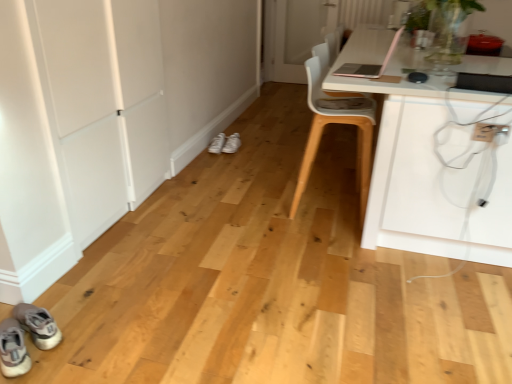
This screenshot has height=384, width=512. What do you see at coordinates (225, 144) in the screenshot? I see `white fabric sneakers at center, placed as the 3th footwear when sorted from bottom to top` at bounding box center [225, 144].

The image size is (512, 384). Describe the element at coordinates (13, 349) in the screenshot. I see `light gray fabric sneakers at lower left, which is counted as the first footwear, starting from the bottom` at that location.

This screenshot has width=512, height=384. In order to click on pink matte laptop at upper right in this screenshot , I will do `click(370, 64)`.

This screenshot has height=384, width=512. Identify the location of white plastic electric outlet at lower right. (488, 131).

This screenshot has width=512, height=384. What do you see at coordinates (488, 131) in the screenshot?
I see `white plastic electric outlet at lower right` at bounding box center [488, 131].

Measure the distance between point [209,147] and camera.

A distance of 3.63 meters exists between point [209,147] and camera.

Find the location of a particular element. The width and height of the screenshot is (512, 384). white plastic chair at upper right is located at coordinates (335, 123).

The width and height of the screenshot is (512, 384). Find the location of `white matte door at left, the first door from the bottom`. white matte door at left, the first door from the bottom is located at coordinates (105, 104).

This screenshot has width=512, height=384. What do you see at coordinates (294, 35) in the screenshot?
I see `white glass door at center, placed as the 2th door when sorted from front to back` at bounding box center [294, 35].

I want to click on white fabric sneakers at center, placed as the first footwear when sorted from top to bottom, so click(225, 144).

Does point (317, 7) lie in front of point (501, 125)?

That is False.

From a real-world perspective, which object stands above the other?

From a 3D spatial view, white plastic electric outlet at lower right is above.

Between white glass door at center, the first door when ordered from back to front, and white plastic electric outlet at lower right, which one is positioned behind?

white glass door at center, the first door when ordered from back to front, is more distant.

Is white matte door at left, the first door from the bottom, completely or partially outside of white leather sneakers at center, which ranks as the second footwear in left-to-right order?

That's correct, white matte door at left, the first door from the bottom, is outside of white leather sneakers at center, which ranks as the second footwear in left-to-right order.

Does white matte door at left, marked as the first door in a left-to-right arrangement, have a smaller size compared to white leather sneakers at center, which is counted as the 2th footwear, starting from the front?

No.

From the picture: Which is more to the right, white matte door at left, arranged as the 2th door when viewed from the top, or white leather sneakers at center, which is the 2th footwear from back to front?

From the viewer's perspective, white leather sneakers at center, which is the 2th footwear from back to front, appears more on the right side.

Does point (142, 68) come closer to viewer compared to point (214, 152)?

Yes, it is.

Based on their sizes in the image, would you say light gray fabric sneakers at lower left, positioned as the third footwear in right-to-left order, is bigger or smaller than pink matte laptop at upper right?

light gray fabric sneakers at lower left, positioned as the third footwear in right-to-left order, is smaller than pink matte laptop at upper right.

From the picture: From a real-world perspective, relative to pink matte laptop at upper right, is light gray fabric sneakers at lower left, marked as the 3th footwear in a back-to-front arrangement, vertically above or below?

Clearly, from a real-world perspective, light gray fabric sneakers at lower left, marked as the 3th footwear in a back-to-front arrangement, is below pink matte laptop at upper right.

Looking at this image, is light gray fabric sneakers at lower left, marked as the 3th footwear in a back-to-front arrangement, looking in the opposite direction of pink matte laptop at upper right?

light gray fabric sneakers at lower left, marked as the 3th footwear in a back-to-front arrangement, is not turned away from pink matte laptop at upper right.

Is light gray fabric sneakers at lower left, positioned as the third footwear in right-to-left order, in contact with pink matte laptop at upper right?

light gray fabric sneakers at lower left, positioned as the third footwear in right-to-left order, and pink matte laptop at upper right are not in contact.

Can you tell me how much white leather sneakers at center, which is the 2th footwear from back to front, and white glass door at center, which is the second door from bottom to top, differ in facing direction?

0.175 degrees separate the facing orientations of white leather sneakers at center, which is the 2th footwear from back to front, and white glass door at center, which is the second door from bottom to top.

Is white leather sneakers at center, which ranks as the second footwear in left-to-right order, in front of white glass door at center, which is the first door from right to left?

Yes, it is in front of white glass door at center, which is the first door from right to left.

Considering the relative sizes of white leather sneakers at center, which is counted as the 2th footwear, starting from the front, and white glass door at center, which is the 2th door in left-to-right order, in the image provided, is white leather sneakers at center, which is counted as the 2th footwear, starting from the front, shorter than white glass door at center, which is the 2th door in left-to-right order,?

Indeed, white leather sneakers at center, which is counted as the 2th footwear, starting from the front, has a lesser height compared to white glass door at center, which is the 2th door in left-to-right order.

Considering the relative sizes of white matte door at left, marked as the first door in a left-to-right arrangement, and pink matte laptop at upper right in the image provided, is white matte door at left, marked as the first door in a left-to-right arrangement, shorter than pink matte laptop at upper right?

No, white matte door at left, marked as the first door in a left-to-right arrangement, is not shorter than pink matte laptop at upper right.

From a real-world perspective, who is located higher, white matte door at left, arranged as the 2th door when viewed from the top, or pink matte laptop at upper right?

In real-world perspective, pink matte laptop at upper right is above.

Find the location of `laptop above the white matte door at left, the second door from the back (from the image's perspective)`. laptop above the white matte door at left, the second door from the back (from the image's perspective) is located at coordinates (370, 64).

Can you confirm if white matte door at left, the 1th door in the front-to-back sequence, is smaller than pink matte laptop at upper right?

No.

Which is farther from the camera, (226, 141) or (283, 51)?

The point (283, 51) is behind.

Can white glass door at center, placed as the 2th door when sorted from front to back, be found inside white fabric sneakers at center, placed as the 3th footwear when sorted from bottom to top?

That's incorrect, white glass door at center, placed as the 2th door when sorted from front to back, is not inside white fabric sneakers at center, placed as the 3th footwear when sorted from bottom to top.

Visually, is white fabric sneakers at center, placed as the first footwear when sorted from top to bottom, positioned to the left or to the right of white glass door at center, which is the second door from bottom to top?

Based on their positions, white fabric sneakers at center, placed as the first footwear when sorted from top to bottom, is located to the left of white glass door at center, which is the second door from bottom to top.

Locate an element on the screen. This screenshot has width=512, height=384. the 2nd door above the white fabric sneakers at center, which appears as the 3th footwear when viewed from the left (from the image's perspective) is located at coordinates [x=294, y=35].

Does pink matte laptop at upper right have a larger size compared to white plastic electric outlet at lower right?

Yes.

Is pink matte laptop at upper right thinner than white plastic electric outlet at lower right?

Incorrect, the width of pink matte laptop at upper right is not less than that of white plastic electric outlet at lower right.

Is point (394, 46) less distant than point (484, 136)?

No, (394, 46) is behind (484, 136).

Is pink matte laptop at upper right oriented away from white plastic electric outlet at lower right?

No, pink matte laptop at upper right is not facing the opposite direction of white plastic electric outlet at lower right.

Locate an element on the screen. electric outlet in front of the white glass door at center, placed as the 2th door when sorted from front to back is located at coordinates (488, 131).

The width and height of the screenshot is (512, 384). Identify the location of the 1st footwear behind the white matte door at left, marked as the first door in a left-to-right arrangement, starting your count from the anchor. (217, 144).

When comparing their distances from white fabric sneakers at center, the 1th footwear viewed from the right, does white leather sneakers at center, which ranks as the 2th footwear in right-to-left order, or white glass door at center, which is the second door from bottom to top, seem further?

white glass door at center, which is the second door from bottom to top, is positioned further to the anchor white fabric sneakers at center, the 1th footwear viewed from the right.

Looking at the image, which one is located further to light gray fabric sneakers at lower left, marked as the 3th footwear in a back-to-front arrangement, pink matte laptop at upper right or white leather sneakers at center, the second footwear ordered from the bottom?

Among the two, white leather sneakers at center, the second footwear ordered from the bottom, is located further to light gray fabric sneakers at lower left, marked as the 3th footwear in a back-to-front arrangement.

Which object lies nearer to the anchor point white matte door at left, arranged as the 2th door when viewed from the top, white plastic electric outlet at lower right or white plastic chair at upper right?

white plastic chair at upper right is positioned closer to the anchor white matte door at left, arranged as the 2th door when viewed from the top.

From the image, which object appears to be farther from white leather sneakers at center, which is the 2th footwear from back to front, white plastic electric outlet at lower right or light gray fabric sneakers at lower left, the first footwear viewed from the front?

light gray fabric sneakers at lower left, the first footwear viewed from the front, is further to white leather sneakers at center, which is the 2th footwear from back to front.

Based on their spatial positions, is light gray fabric sneakers at lower left, the 3th footwear positioned from the top, or white plastic chair at upper right further from white matte door at left, the second door from the back?

The object further to white matte door at left, the second door from the back, is white plastic chair at upper right.

Based on their spatial positions, is light gray fabric sneakers at lower left, the 3th footwear positioned from the top, or white plastic electric outlet at lower right closer to white glass door at center, which is the 2th door in left-to-right order?

white plastic electric outlet at lower right.

Which object lies nearer to the anchor point white plastic electric outlet at lower right, white glass door at center, which is the second door from bottom to top, or pink matte laptop at upper right?

pink matte laptop at upper right is closer to white plastic electric outlet at lower right.

Based on their spatial positions, is white matte door at left, which appears as the 2th door when viewed from the right, or pink matte laptop at upper right closer to white leather sneakers at center, which is counted as the 2th footwear, starting from the front?

Result: white matte door at left, which appears as the 2th door when viewed from the right, is positioned closer to the anchor white leather sneakers at center, which is counted as the 2th footwear, starting from the front.

Image resolution: width=512 pixels, height=384 pixels. In order to click on laptop between white plastic electric outlet at lower right and white leather sneakers at center, the second footwear ordered from the bottom, from front to back in this screenshot , I will do `click(370, 64)`.

Locate an element on the screen. Image resolution: width=512 pixels, height=384 pixels. electric outlet between light gray fabric sneakers at lower left, the 1th footwear when ordered from left to right, and white leather sneakers at center, acting as the second footwear starting from the top, from front to back is located at coordinates (488, 131).

Where is `electric outlet located between light gray fabric sneakers at lower left, which is counted as the first footwear, starting from the bottom, and white glass door at center, which is the first door in top-to-bottom order, in the depth direction`? Image resolution: width=512 pixels, height=384 pixels. electric outlet located between light gray fabric sneakers at lower left, which is counted as the first footwear, starting from the bottom, and white glass door at center, which is the first door in top-to-bottom order, in the depth direction is located at coordinates (488, 131).

I want to click on footwear located between white matte door at left, which appears as the 2th door when viewed from the right, and white fabric sneakers at center, placed as the first footwear when sorted from top to bottom, in the depth direction, so click(217, 144).